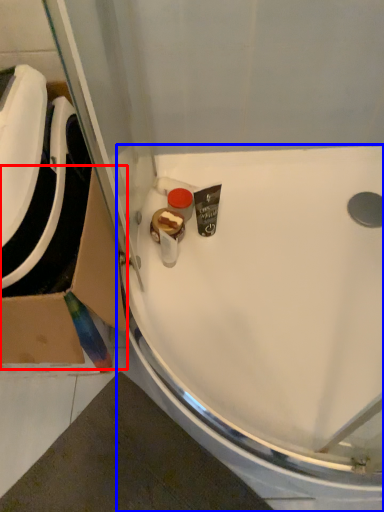
Question: Among these objects, which one is farthest to the camera, cardboard box (highlighted by a red box) or sink (highlighted by a blue box)?

Choices:
 (A) cardboard box
 (B) sink

Answer: (B)